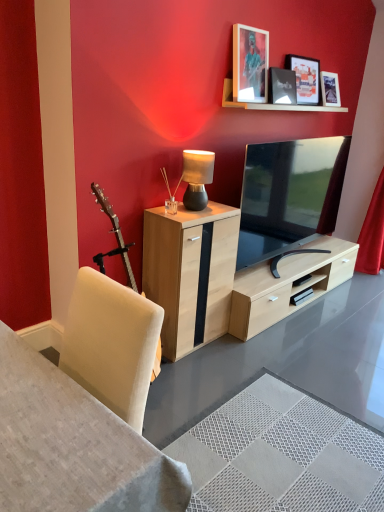
Identify the location of free spot above light wood cabinet at center (from a real-world perspective). The width and height of the screenshot is (384, 512). (199, 209).